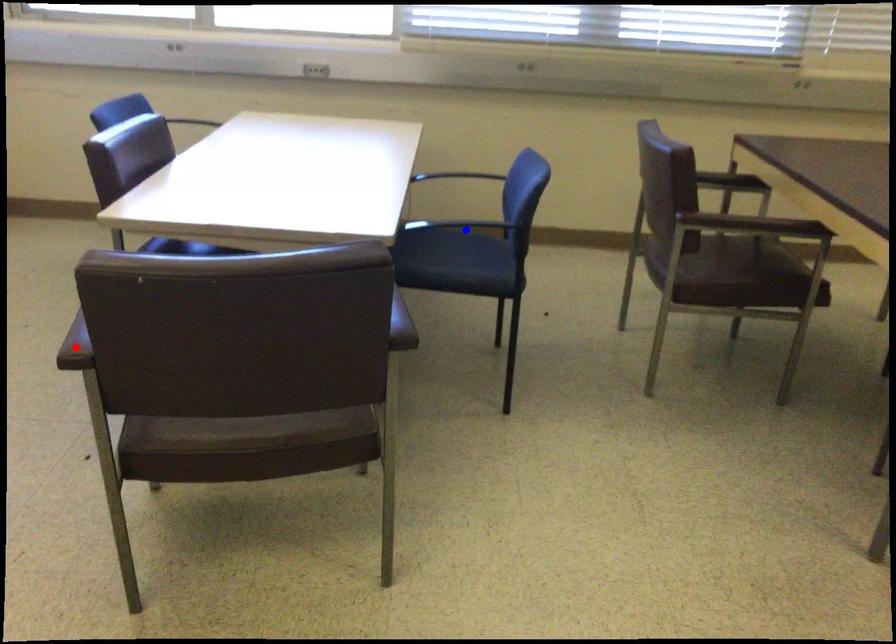
Question: Which of the two points in the image is closer to the camera?

Choices:
 (A) Blue point is closer.
 (B) Red point is closer.

Answer: (B)